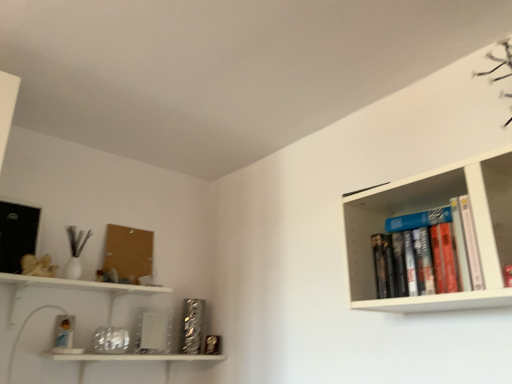
Identify the location of corkboard at upper left. This screenshot has width=512, height=384. (127, 256).

The width and height of the screenshot is (512, 384). What do you see at coordinates (127, 256) in the screenshot?
I see `corkboard at upper left` at bounding box center [127, 256].

Where is `hardcover books at upper right`? The image size is (512, 384). hardcover books at upper right is located at coordinates (444, 246).

Describe the element at coordinates (444, 246) in the screenshot. I see `hardcover books at upper right` at that location.

Identify the location of corkboard at upper left. (x=127, y=256).

Which is more to the left, corkboard at upper left or hardcover books at upper right?

corkboard at upper left is more to the left.

Is corkboard at upper left positioned before hardcover books at upper right?

No, the depth of corkboard at upper left is greater than that of hardcover books at upper right.

Does point (123, 260) come behind point (408, 230)?

That is True.

Consider the image. From the image's perspective, which object appears higher, corkboard at upper left or hardcover books at upper right?

From the image's view, hardcover books at upper right is above.

From a real-world perspective, is corkboard at upper left physically above hardcover books at upper right?

Correct, in the physical world, corkboard at upper left is higher than hardcover books at upper right.

Is corkboard at upper left thinner than hardcover books at upper right?

Yes, corkboard at upper left is thinner than hardcover books at upper right.

Is corkboard at upper left taller or shorter than hardcover books at upper right?

Considering their sizes, corkboard at upper left has more height than hardcover books at upper right.

Considering the sizes of objects corkboard at upper left and hardcover books at upper right in the image provided, who is smaller, corkboard at upper left or hardcover books at upper right?

Smaller between the two is corkboard at upper left.

Is corkboard at upper left inside or outside of hardcover books at upper right?

corkboard at upper left exists outside the volume of hardcover books at upper right.

Are corkboard at upper left and hardcover books at upper right far apart?

Yes.

Is corkboard at upper left oriented away from hardcover books at upper right?

corkboard at upper left is not turned away from hardcover books at upper right.

How different are the orientations of corkboard at upper left and hardcover books at upper right in degrees?

The angle between the facing direction of corkboard at upper left and the facing direction of hardcover books at upper right is 92 degrees.

In the image, there is a hardcover books at upper right. Identify the location of book cover below it (from the image's perspective). (127, 256).

Looking at this image, considering the relative positions of hardcover books at upper right and corkboard at upper left in the image provided, is hardcover books at upper right to the left or to the right of corkboard at upper left?

From the image, it's evident that hardcover books at upper right is to the right of corkboard at upper left.

Considering their positions, is hardcover books at upper right located in front of or behind corkboard at upper left?

hardcover books at upper right is positioned closer to the viewer than corkboard at upper left.

Does point (407, 264) come farther from viewer compared to point (149, 282)?

No, it is in front of (149, 282).

Consider the image. From the image's perspective, is hardcover books at upper right above corkboard at upper left?

Yes.

From a real-world perspective, between hardcover books at upper right and corkboard at upper left, who is vertically lower?

hardcover books at upper right, from a real-world perspective.

Which object is thinner, hardcover books at upper right or corkboard at upper left?

With smaller width is corkboard at upper left.

Which of these two, hardcover books at upper right or corkboard at upper left, stands shorter?

With less height is hardcover books at upper right.

Considering the relative sizes of hardcover books at upper right and corkboard at upper left in the image provided, is hardcover books at upper right smaller than corkboard at upper left?

No.

Which is correct: hardcover books at upper right is inside corkboard at upper left, or outside of it?

hardcover books at upper right is not enclosed by corkboard at upper left.

Is hardcover books at upper right not near corkboard at upper left?

hardcover books at upper right is far away from corkboard at upper left.

Is hardcover books at upper right looking in the opposite direction of corkboard at upper left?

No.

What's the angular difference between hardcover books at upper right and corkboard at upper left's facing directions?

The facing directions of hardcover books at upper right and corkboard at upper left are 92 degrees apart.

Measure the distance between hardcover books at upper right and corkboard at upper left.

4.36 feet.

The width and height of the screenshot is (512, 384). Identify the location of book that is under the corkboard at upper left (from a real-world perspective). (444, 246).

Image resolution: width=512 pixels, height=384 pixels. In order to click on book cover lying on the left of hardcover books at upper right in this screenshot , I will do (127, 256).

Locate an element on the screen. The height and width of the screenshot is (384, 512). book in front of the corkboard at upper left is located at coordinates (444, 246).